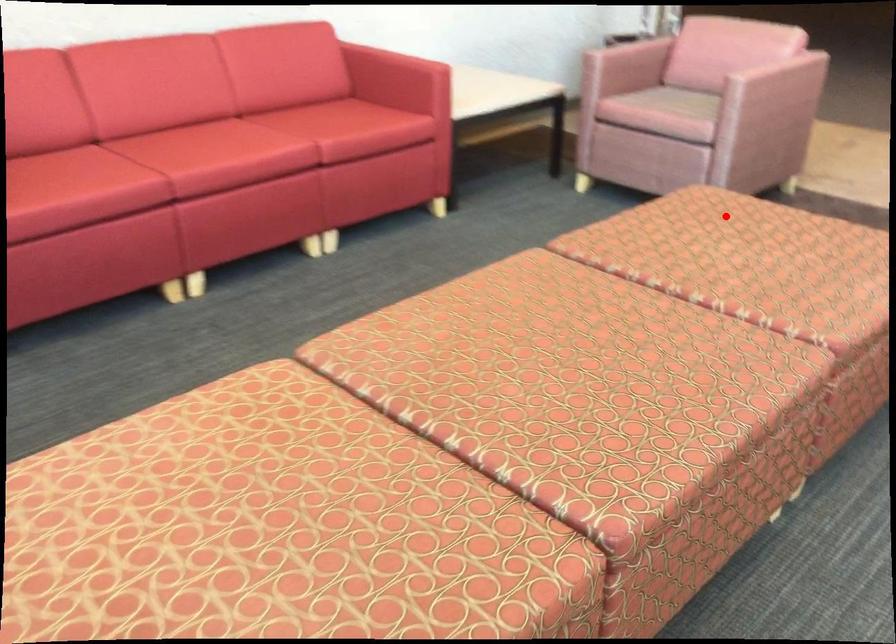
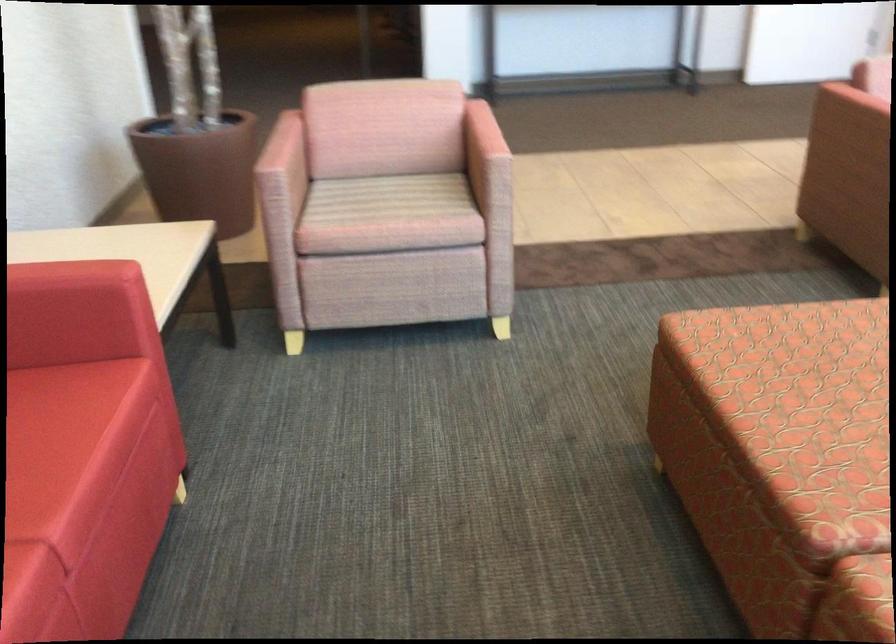
Question: I am providing you with two images of the same scene from different viewpoints. Given a red point in image1, look at the same physical point in image2. Is it:

Choices:
 (A) Closer to the viewpoint
 (B) Farther from the viewpoint

Answer: (A)